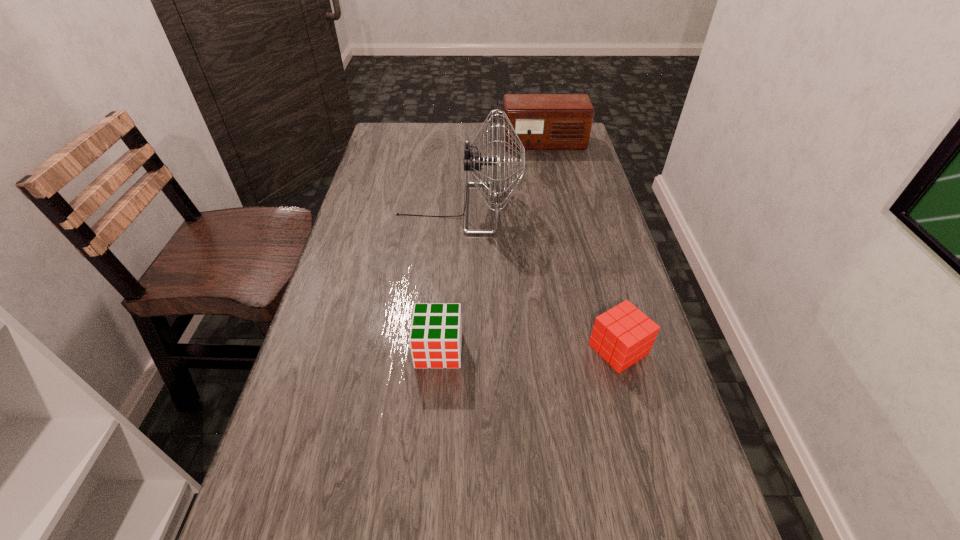
Find the location of `empty location between the farthest object and the right cube`. empty location between the farthest object and the right cube is located at coordinates (581, 246).

The height and width of the screenshot is (540, 960). Find the location of `free point between the third shortest object and the third nearest object`. free point between the third shortest object and the third nearest object is located at coordinates (501, 176).

At what (x,y) coordinates should I click in order to perform the action: click on free space between the third shortest object and the left cube. Please return your answer as a coordinate pair (x, y). This screenshot has height=540, width=960. Looking at the image, I should click on (492, 247).

At what (x,y) coordinates should I click in order to perform the action: click on vacant area between the right cube and the radio receiver. Please return your answer as a coordinate pair (x, y). This screenshot has height=540, width=960. Looking at the image, I should click on (581, 246).

Where is `vacant space that is in between the left cube and the third shortest object`? The image size is (960, 540). vacant space that is in between the left cube and the third shortest object is located at coordinates (492, 247).

Locate an element on the screen. This screenshot has height=540, width=960. free spot between the tallest object and the right cube is located at coordinates (539, 279).

Where is `the third closest object to the tallest object`? the third closest object to the tallest object is located at coordinates (623, 335).

Select which object is the second closest to the left cube. Please provide its 2D coordinates. Your answer should be formatted as a tuple, i.e. [(x, y)], where the tuple contains the x and y coordinates of a point satisfying the conditions above.

[(472, 160)]

The image size is (960, 540). I want to click on free point that satisfies the following two spatial constraints: 1. on the front-facing side of the fan; 2. on the red face of the left cube, so pyautogui.click(x=450, y=350).

At what (x,y) coordinates should I click in order to perform the action: click on vacant space that satisfies the following two spatial constraints: 1. on the front-facing side of the radio receiver; 2. on the front-facing side of the fan. Please return your answer as a coordinate pair (x, y). Looking at the image, I should click on (558, 208).